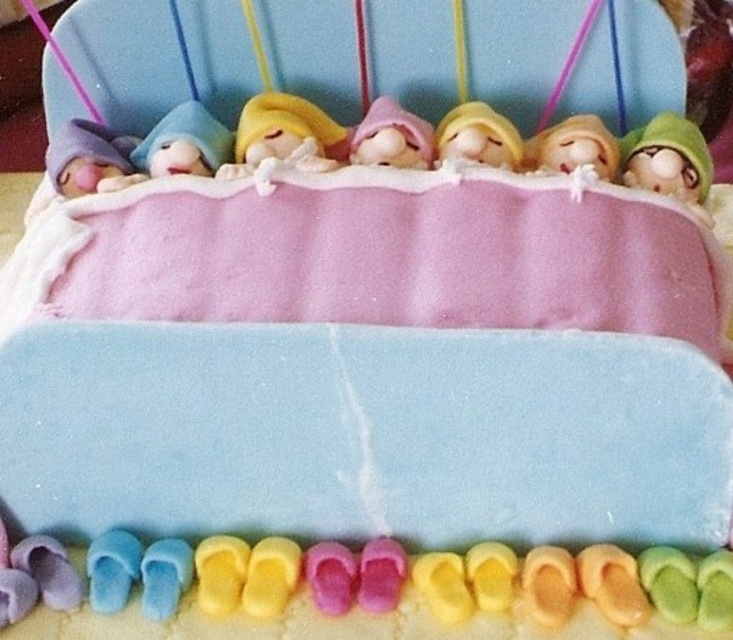
Please look at the cake bed in the image. There is a point marked at coordinates [284,131]. What is located at this point?

At point [284,131] lies the yellow felt baby at center.

You are a photographer positioned at the center of the cake scene. You want to take a photo that includes both the point at coordinates point (x=314, y=163) and point (x=550, y=144). Based on their positions, which point should be closer to the camera lens?

Point (x=314, y=163) is in front of point (x=550, y=144), so it will be closer to the camera lens.

You are a guest at a birthday party and want to place a candle on the tallest baby between the yellow felt baby at center and the pink fondant baby at center. Which baby should you place the candle on?

The yellow felt baby at center is taller than the pink fondant baby at center, so you should place the candle on the yellow felt baby at center.